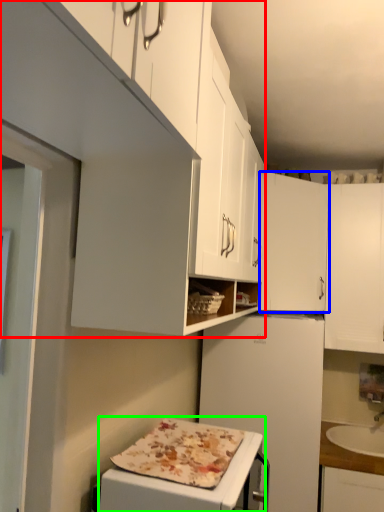
Question: Which object is the farthest from cabinetry (highlighted by a red box)? Choose among these: cabinetry (highlighted by a blue box) or appliance (highlighted by a green box).

Choices:
 (A) cabinetry
 (B) appliance

Answer: (A)